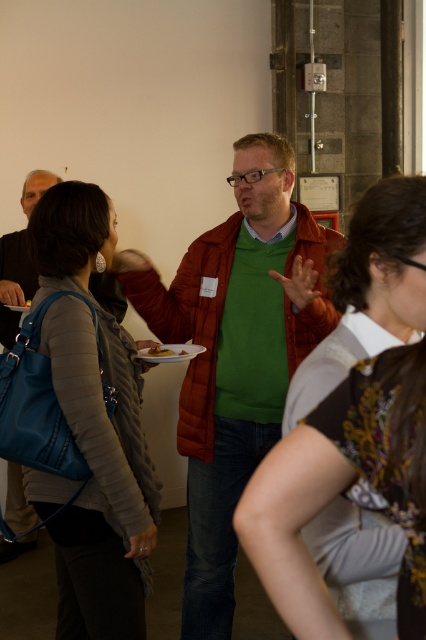
Between matte green sweater at center and floral-patterned blouse at center, which one is positioned lower?

matte green sweater at center is below.

Between matte green sweater at center and floral-patterned blouse at center, which one appears on the right side from the viewer's perspective?

From the viewer's perspective, floral-patterned blouse at center appears more on the right side.

This screenshot has height=640, width=426. What do you see at coordinates (236, 353) in the screenshot?
I see `matte green sweater at center` at bounding box center [236, 353].

At what (x,y) coordinates should I click in order to perform the action: click on matte green sweater at center. Please return your answer as a coordinate pair (x, y). The image size is (426, 640). Looking at the image, I should click on (236, 353).

Who is lower down, matte green sweater at center or matte blue leather handbag at left?

matte blue leather handbag at left is below.

In the scene shown: Does matte green sweater at center have a lesser width compared to matte blue leather handbag at left?

In fact, matte green sweater at center might be wider than matte blue leather handbag at left.

Who is more distant from viewer, (x=293, y=228) or (x=120, y=372)?

The point (x=293, y=228) is more distant.

Find the location of a particular element. The height and width of the screenshot is (640, 426). matte green sweater at center is located at coordinates pos(236,353).

Measure the distance between matte blue leather handbag at left and floral-patterned blouse at center.

matte blue leather handbag at left is 30.60 inches away from floral-patterned blouse at center.

What do you see at coordinates (94, 424) in the screenshot? This screenshot has height=640, width=426. I see `matte blue leather handbag at left` at bounding box center [94, 424].

Where is `matte blue leather handbag at left`? The height and width of the screenshot is (640, 426). matte blue leather handbag at left is located at coordinates (94, 424).